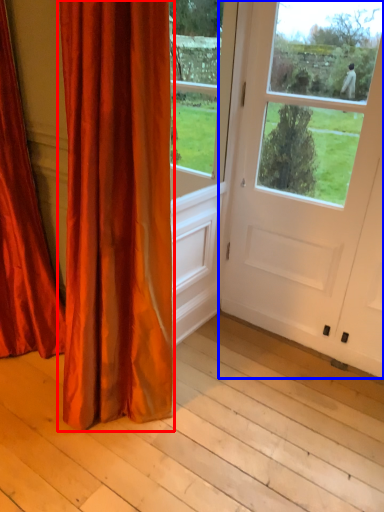
Question: Among these objects, which one is farthest to the camera, curtain (highlighted by a red box) or door (highlighted by a blue box)?

Choices:
 (A) curtain
 (B) door

Answer: (B)